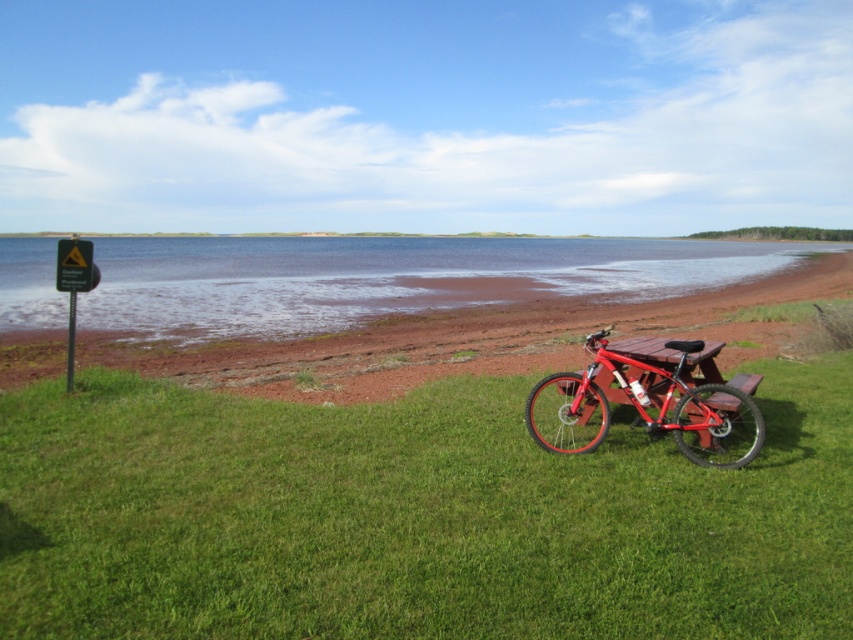
Question: Which object is positioned farthest from the green grassy at lower center?

Choices:
 (A) shiny red mountain bike at center
 (B) clear blue water at center

Answer: (B)

Question: Is green grassy at lower center to the right of shiny red mountain bike at center from the viewer's perspective?

Choices:
 (A) no
 (B) yes

Answer: (A)

Question: Is clear blue water at center wider than shiny red mountain bike at center?

Choices:
 (A) yes
 (B) no

Answer: (A)

Question: Among these points, which one is farthest from the camera?

Choices:
 (A) (724, 413)
 (B) (309, 611)
 (C) (202, 292)

Answer: (C)

Question: Where is clear blue water at center located in relation to shiny red mountain bike at center in the image?

Choices:
 (A) below
 (B) above

Answer: (B)

Question: Estimate the real-world distances between objects in this image. Which object is closer to the clear blue water at center?

Choices:
 (A) shiny red mountain bike at center
 (B) green grassy at lower center

Answer: (A)